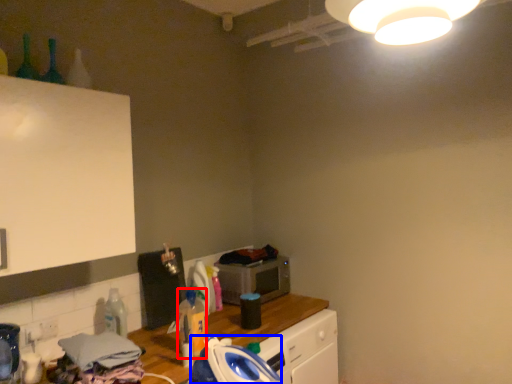
Question: Which object appears farthest to the camera in this image, bottle (highlighted by a red box) or appliance (highlighted by a blue box)?

Choices:
 (A) bottle
 (B) appliance

Answer: (A)